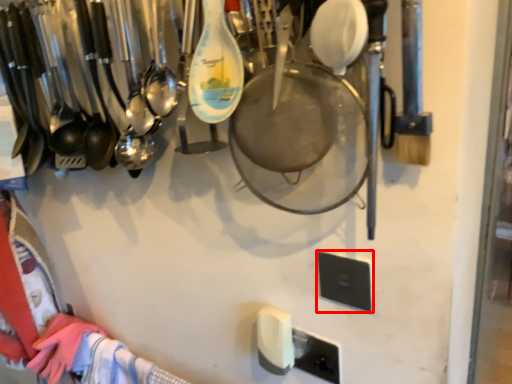
Question: Observing the image, what is the correct spatial positioning of light switch (annotated by the red box) in reference to light switch?

Choices:
 (A) right
 (B) left

Answer: (A)